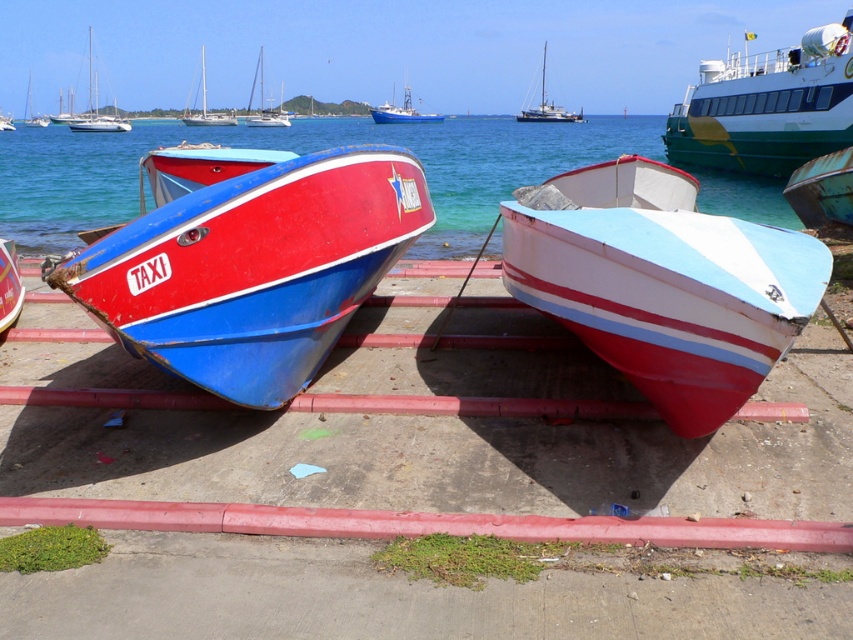
Does matte plastic boat at left appear over rusty metal boat at right?

No, matte plastic boat at left is not above rusty metal boat at right.

Does matte plastic boat at left have a greater height compared to rusty metal boat at right?

Indeed, matte plastic boat at left has a greater height compared to rusty metal boat at right.

Which is behind, point (202, 374) or point (843, 160)?

The point (843, 160) is behind.

What are the coordinates of `matte plastic boat at left` in the screenshot? It's located at (254, 269).

Is point (444, 204) positioned after point (30, 106)?

That is False.

Is clear blue water at center positioned in front of red matte taxi boat at left?

Yes, clear blue water at center is closer to the viewer.

Who is more forward, (469, 170) or (38, 122)?

Point (469, 170)

Find the location of a particular element. The image size is (853, 640). clear blue water at center is located at coordinates (303, 154).

Does matte plastic boat at left come behind clear blue water at center?

No, it is in front of clear blue water at center.

Describe the element at coordinates (254, 269) in the screenshot. Image resolution: width=853 pixels, height=640 pixels. I see `matte plastic boat at left` at that location.

Which is behind, point (131, 288) or point (476, 122)?

The point (476, 122) is more distant.

This screenshot has width=853, height=640. Find the location of `matte plastic boat at left`. matte plastic boat at left is located at coordinates (254, 269).